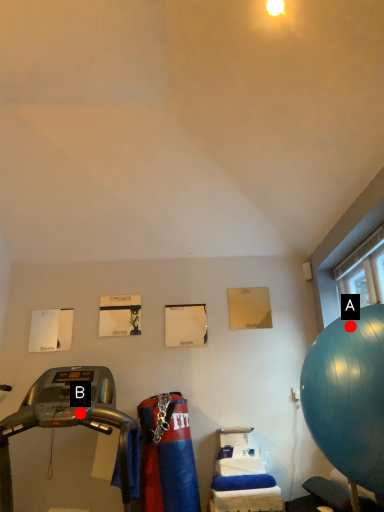
Question: Two points are circled on the image, labeled by A and B beside each circle. Which point is further to the camera?

Choices:
 (A) A is further
 (B) B is further

Answer: (B)